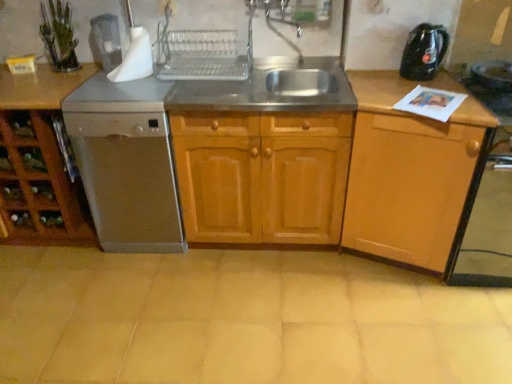
Identify the location of light brown wood cabinet at right, the 3th cabinetry when ordered from left to right. Image resolution: width=512 pixels, height=384 pixels. (409, 171).

What is the approximate height of clear glass dish rack at upper center?

clear glass dish rack at upper center is 8.38 inches in height.

The image size is (512, 384). What do you see at coordinates (202, 55) in the screenshot? I see `clear glass dish rack at upper center` at bounding box center [202, 55].

This screenshot has height=384, width=512. Identify the location of brown wood cabinet at left, the 3th cabinetry viewed from the right. (41, 157).

This screenshot has height=384, width=512. What do you see at coordinates (242, 320) in the screenshot?
I see `beige ceramic tile at center` at bounding box center [242, 320].

In order to click on satin white coffee machine at upper left in this screenshot , I will do `click(106, 41)`.

What do you see at coordinates (424, 52) in the screenshot? The width and height of the screenshot is (512, 384). I see `black plastic kettle at upper right` at bounding box center [424, 52].

Identify the location of white plastic electric outlet at upper center. The height and width of the screenshot is (384, 512). (168, 7).

I want to click on light brown wood cabinet at right, the 3th cabinetry when ordered from left to right, so click(x=409, y=171).

Which object is more forward, white plastic electric outlet at upper center or stainless steel sink at center?

stainless steel sink at center is in front.

Image resolution: width=512 pixels, height=384 pixels. Identify the location of electric outlet that appears above the stainless steel sink at center (from the image's perspective). (168, 7).

Is white plastic electric outlet at upper center wider than stainless steel sink at center?

In fact, white plastic electric outlet at upper center might be narrower than stainless steel sink at center.

From the image's perspective, is beige ceramic tile at center located above or below light brown wood cabinet at right, the 3th cabinetry when ordered from left to right?

From the image's perspective, beige ceramic tile at center appears below light brown wood cabinet at right, the 3th cabinetry when ordered from left to right.

How much distance is there between beige ceramic tile at center and light brown wood cabinet at right, marked as the 1th cabinetry in a right-to-left arrangement?

beige ceramic tile at center is 22.87 inches away from light brown wood cabinet at right, marked as the 1th cabinetry in a right-to-left arrangement.

Considering the points (225, 305) and (354, 81), which point is in front, point (225, 305) or point (354, 81)?

The point (225, 305) is closer.

From a real-world perspective, is beige ceramic tile at center on light brown wood cabinet at right, marked as the 1th cabinetry in a right-to-left arrangement?

Incorrect, from a real-world perspective, beige ceramic tile at center is lower than light brown wood cabinet at right, marked as the 1th cabinetry in a right-to-left arrangement.

Choose the correct answer: Is wooden cabinet at center, placed as the 2th cabinetry when sorted from left to right, inside beige ceramic tile at center or outside it?

wooden cabinet at center, placed as the 2th cabinetry when sorted from left to right, is not enclosed by beige ceramic tile at center.

Is wooden cabinet at center, which is counted as the second cabinetry, starting from the right, in front of or behind beige ceramic tile at center in the image?

wooden cabinet at center, which is counted as the second cabinetry, starting from the right, is behind beige ceramic tile at center.

Does point (251, 196) come farther from viewer compared to point (262, 364)?

Yes, it is behind point (262, 364).

From the image's perspective, who appears lower, wooden cabinet at center, which is counted as the second cabinetry, starting from the right, or beige ceramic tile at center?

From the image's view, beige ceramic tile at center is below.

Is clear glass dish rack at upper center with light brown wood cabinet at right, the 3th cabinetry when ordered from left to right?

No, clear glass dish rack at upper center is not making contact with light brown wood cabinet at right, the 3th cabinetry when ordered from left to right.

Is light brown wood cabinet at right, the 3th cabinetry when ordered from left to right, completely or partially inside clear glass dish rack at upper center?

Definitely not — light brown wood cabinet at right, the 3th cabinetry when ordered from left to right, is not inside clear glass dish rack at upper center.

Is clear glass dish rack at upper center looking in the opposite direction of light brown wood cabinet at right, the 3th cabinetry when ordered from left to right?

No, clear glass dish rack at upper center is not facing away from light brown wood cabinet at right, the 3th cabinetry when ordered from left to right.

Considering the sizes of clear glass dish rack at upper center and light brown wood cabinet at right, marked as the 1th cabinetry in a right-to-left arrangement, in the image, is clear glass dish rack at upper center bigger or smaller than light brown wood cabinet at right, marked as the 1th cabinetry in a right-to-left arrangement,?

In the image, clear glass dish rack at upper center appears to be smaller than light brown wood cabinet at right, marked as the 1th cabinetry in a right-to-left arrangement.

Is beige ceramic tile at center at the right side of stainless steel sink at center?

Incorrect, beige ceramic tile at center is not on the right side of stainless steel sink at center.

Considering the positions of points (195, 368) and (270, 81), is point (195, 368) farther from camera compared to point (270, 81)?

No, (195, 368) is in front of (270, 81).

From a real-world perspective, is beige ceramic tile at center positioned over stainless steel sink at center based on gravity?

No, from a real-world perspective, beige ceramic tile at center is not over stainless steel sink at center

Does beige ceramic tile at center have a smaller size compared to stainless steel sink at center?

Actually, beige ceramic tile at center might be larger than stainless steel sink at center.

Which is more to the left, metallic silver faucet at upper center or wooden cabinet at center, which is counted as the second cabinetry, starting from the right?

Positioned to the left is wooden cabinet at center, which is counted as the second cabinetry, starting from the right.

Image resolution: width=512 pixels, height=384 pixels. In order to click on faucet above the wooden cabinet at center, which is counted as the second cabinetry, starting from the right (from the image's perspective) in this screenshot , I will do `click(274, 21)`.

Does metallic silver faucet at upper center have a lesser width compared to wooden cabinet at center, placed as the 2th cabinetry when sorted from left to right?

Correct, the width of metallic silver faucet at upper center is less than that of wooden cabinet at center, placed as the 2th cabinetry when sorted from left to right.

Considering the relative sizes of light brown wood cabinet at right, the 3th cabinetry when ordered from left to right, and black plastic kettle at upper right in the image provided, is light brown wood cabinet at right, the 3th cabinetry when ordered from left to right, thinner than black plastic kettle at upper right?

In fact, light brown wood cabinet at right, the 3th cabinetry when ordered from left to right, might be wider than black plastic kettle at upper right.

Which of these two, light brown wood cabinet at right, marked as the 1th cabinetry in a right-to-left arrangement, or black plastic kettle at upper right, is smaller?

With smaller size is black plastic kettle at upper right.

Considering the positions of points (421, 205) and (435, 46), is point (421, 205) closer to camera compared to point (435, 46)?

That is True.

Are light brown wood cabinet at right, marked as the 1th cabinetry in a right-to-left arrangement, and black plastic kettle at upper right far apart?

That's not correct — light brown wood cabinet at right, marked as the 1th cabinetry in a right-to-left arrangement, is a little close to black plastic kettle at upper right.

You are a GUI agent. You are given a task and a screenshot of the screen. Output one action in this format:
    pyautogui.click(x=<x>, y=<y>)
    Task: Click on the electric outlet behind the stainless steel sink at center
    This screenshot has height=384, width=512.
    Given the screenshot: What is the action you would take?
    pyautogui.click(x=168, y=7)

Locate an element on the screen. The image size is (512, 384). ceramic tile lying in front of the light brown wood cabinet at right, the 3th cabinetry when ordered from left to right is located at coordinates (242, 320).

Consider the image. Considering their positions, is clear glass dish rack at upper center positioned further to metallic silver faucet at upper center than satin silver dishwasher at left?

satin silver dishwasher at left is further to metallic silver faucet at upper center.

Which object lies further to the anchor point clear glass dish rack at upper center, stainless steel sink at center or white plastic electric outlet at upper center?

stainless steel sink at center is further to clear glass dish rack at upper center.

Which object lies further to the anchor point clear glass dish rack at upper center, wooden cabinet at center, which is counted as the second cabinetry, starting from the right, or satin silver dishwasher at left?

The object further to clear glass dish rack at upper center is satin silver dishwasher at left.

Looking at the image, which one is located further to beige ceramic tile at center, metallic silver faucet at upper center or light brown wood cabinet at right, the 3th cabinetry when ordered from left to right?

Based on the image, metallic silver faucet at upper center appears to be further to beige ceramic tile at center.

Looking at this image, based on their spatial positions, is satin silver dishwasher at left or satin white coffee machine at upper left further from brown wood cabinet at left, the 3th cabinetry viewed from the right?

satin white coffee machine at upper left.

From the image, which object appears to be nearer to black plastic kettle at upper right, satin white coffee machine at upper left or brown wood cabinet at left, which ranks as the 1th cabinetry in left-to-right order?

Based on the image, satin white coffee machine at upper left appears to be nearer to black plastic kettle at upper right.

Consider the image. From the image, which object appears to be nearer to light brown wood cabinet at right, marked as the 1th cabinetry in a right-to-left arrangement, metallic silver faucet at upper center or brown wood cabinet at left, which ranks as the 1th cabinetry in left-to-right order?

Based on the image, metallic silver faucet at upper center appears to be nearer to light brown wood cabinet at right, marked as the 1th cabinetry in a right-to-left arrangement.

Based on their spatial positions, is satin white coffee machine at upper left or stainless steel sink at center closer to white plastic electric outlet at upper center?

The object closer to white plastic electric outlet at upper center is satin white coffee machine at upper left.

Locate an element on the screen. The image size is (512, 384). cabinetry located between satin silver dishwasher at left and light brown wood cabinet at right, marked as the 1th cabinetry in a right-to-left arrangement, in the left-right direction is located at coordinates (262, 176).

Identify the location of home appliance situated between satin white coffee machine at upper left and wooden cabinet at center, placed as the 2th cabinetry when sorted from left to right, from left to right. Image resolution: width=512 pixels, height=384 pixels. (128, 179).

Where is `appliance situated between white plastic electric outlet at upper center and stainless steel sink at center from left to right`? appliance situated between white plastic electric outlet at upper center and stainless steel sink at center from left to right is located at coordinates click(x=202, y=55).

What are the coordinates of `sink located between brown wood cabinet at left, the 3th cabinetry viewed from the right, and light brown wood cabinet at right, the 3th cabinetry when ordered from left to right, in the left-right direction` in the screenshot? It's located at pos(271,90).